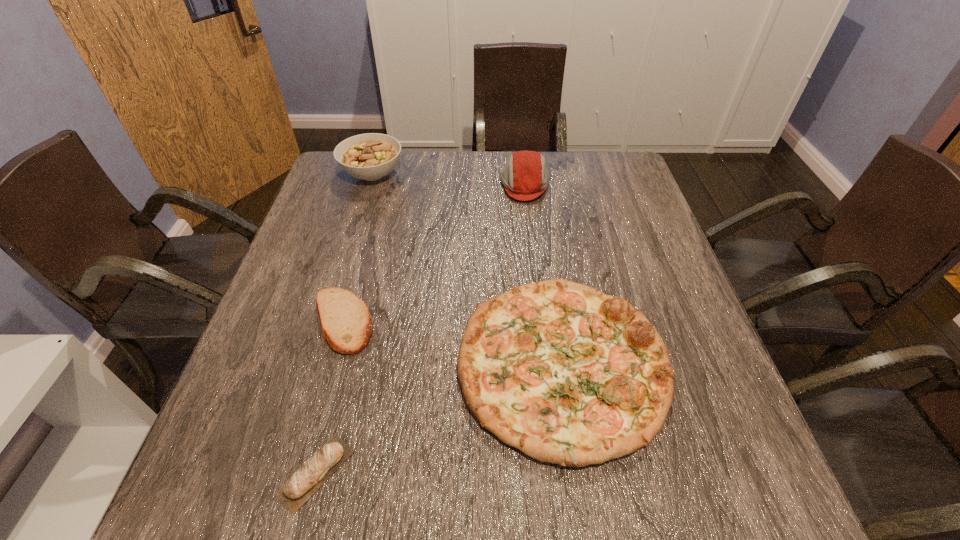
You are a GUI agent. You are given a task and a screenshot of the screen. Output one action in this format:
    pyautogui.click(x=<x>, y=<y>)
    Task: Click on the object present at the near right corner
    
    Given the screenshot: What is the action you would take?
    pyautogui.click(x=568, y=375)

This screenshot has width=960, height=540. Find the location of `blank space at the far edge of the desktop`. blank space at the far edge of the desktop is located at coordinates (553, 196).

What are the coordinates of `vacant space at the left edge of the desktop` in the screenshot? It's located at (313, 319).

Where is `vacant position at the right edge of the desktop`? The height and width of the screenshot is (540, 960). vacant position at the right edge of the desktop is located at coordinates (617, 254).

Where is `blank space at the far right corner of the desktop`? This screenshot has width=960, height=540. blank space at the far right corner of the desktop is located at coordinates (584, 188).

Identify the location of vacant region at the near right corner of the desktop. Image resolution: width=960 pixels, height=540 pixels. (734, 514).

The image size is (960, 540). What are the coordinates of `free space between the cap and the pizza` in the screenshot? It's located at (543, 275).

This screenshot has height=540, width=960. I want to click on free space between the nearer pita bread and the farther pita bread, so click(329, 397).

Locate an element on the screen. unoccupied position between the farther pita bread and the stew is located at coordinates (358, 248).

Find the location of a particular element. blank region between the nearer pita bread and the cap is located at coordinates (420, 328).